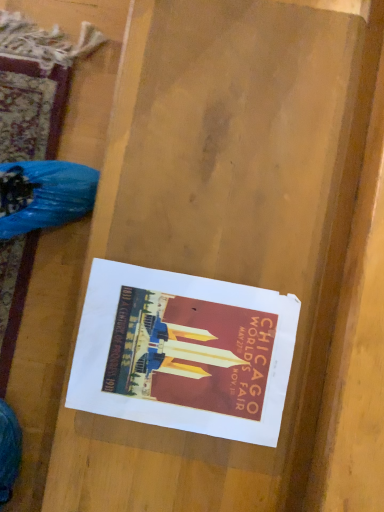
Locate an element on the screen. Image resolution: width=384 pixels, height=512 pixels. white paper poster at center is located at coordinates (184, 352).

Measure the distance between white paper poster at center and camera.

They are 58.58 centimeters apart.

Image resolution: width=384 pixels, height=512 pixels. What do you see at coordinates (184, 352) in the screenshot? I see `white paper poster at center` at bounding box center [184, 352].

Where is `white paper poster at center`? Image resolution: width=384 pixels, height=512 pixels. white paper poster at center is located at coordinates (184, 352).